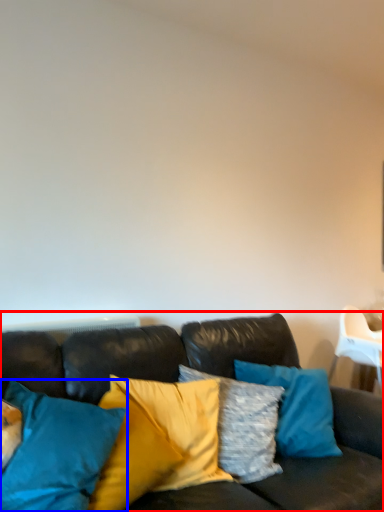
Question: Which of the following is the farthest to the observer, studio couch (highlighted by a red box) or pillow (highlighted by a blue box)?

Choices:
 (A) studio couch
 (B) pillow

Answer: (B)